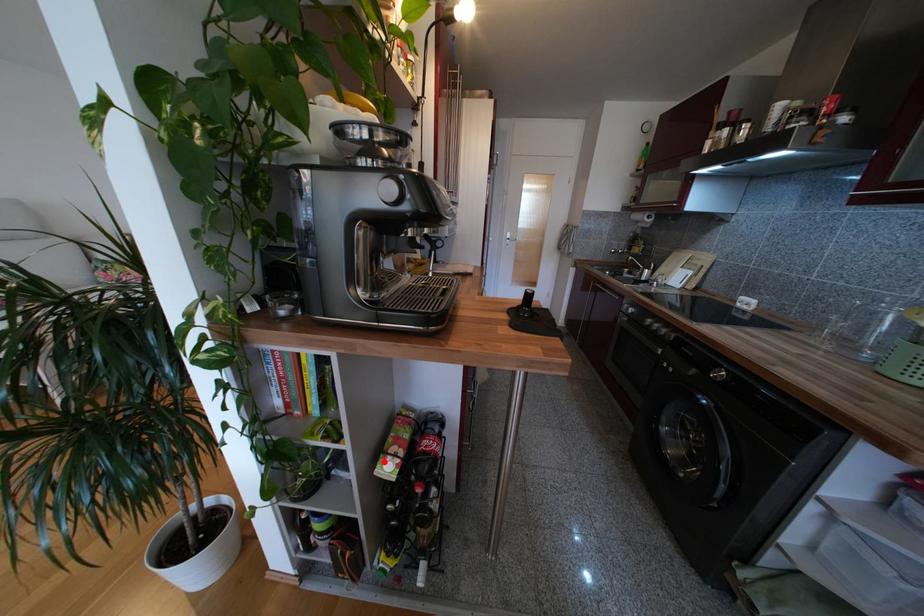
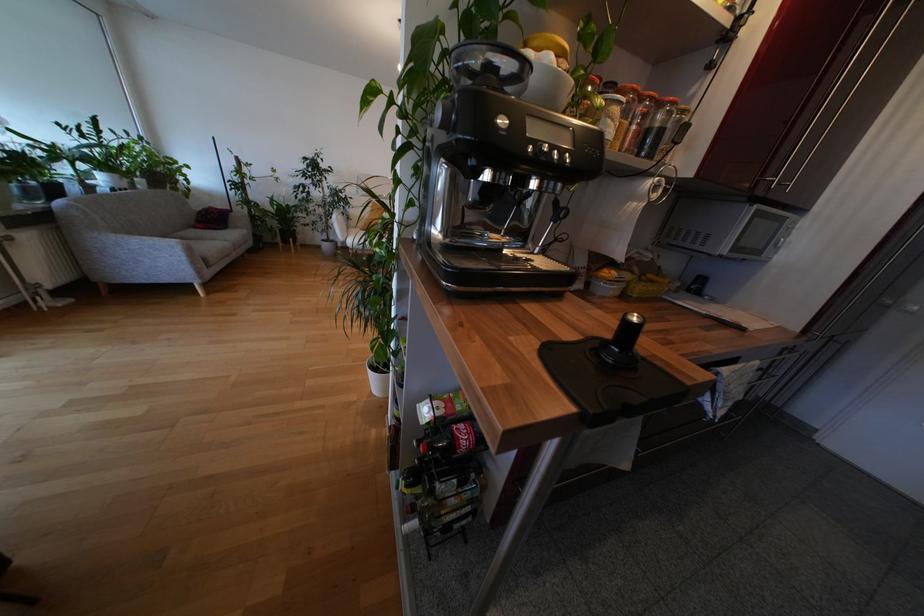
The point at the highlighted location is marked in the first image. Where is the corresponding point in the second image?

(431, 402)